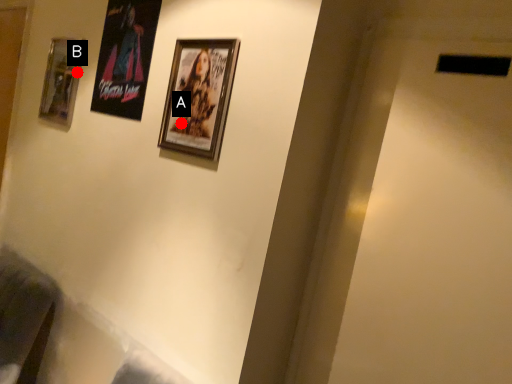
Question: Two points are circled on the image, labeled by A and B beside each circle. Which point appears closest to the camera in this image?

Choices:
 (A) A is closer
 (B) B is closer

Answer: (A)